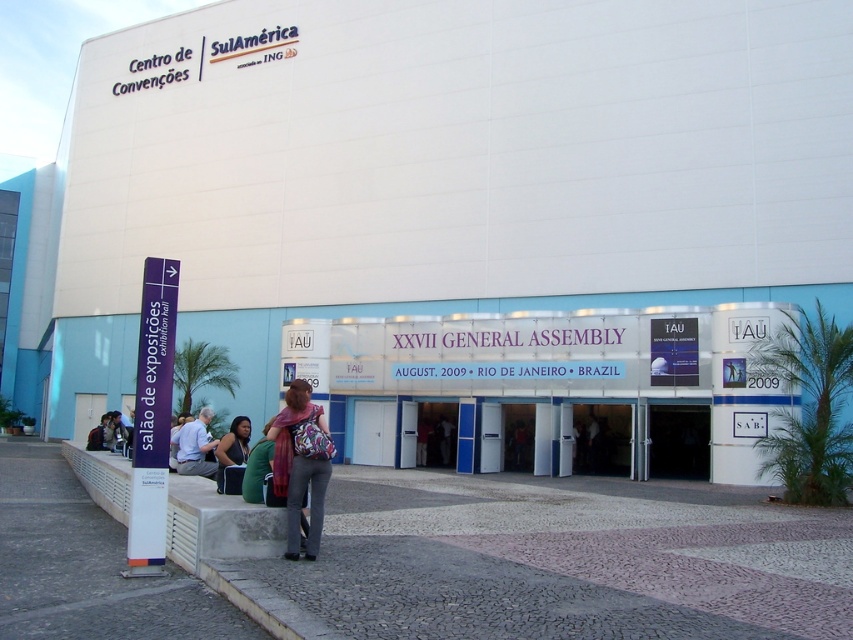
Question: Which of the following is the closest to the observer?

Choices:
 (A) (206, 444)
 (B) (486, 376)
 (C) (242, 420)
 (D) (312, 513)

Answer: (D)

Question: Which point is closer to the camera taking this photo?

Choices:
 (A) (221, 440)
 (B) (271, 436)
 (C) (183, 424)
 (D) (508, 401)

Answer: (B)

Question: Can you confirm if matte purple scarf at center is smaller than matte black jacket at lower center?

Choices:
 (A) yes
 (B) no

Answer: (A)

Question: Does light blue fabric jacket at lower left have a smaller size compared to matte black jacket at lower center?

Choices:
 (A) yes
 (B) no

Answer: (A)

Question: Which is farther from the matte black jacket at lower center?

Choices:
 (A) white glossy signboard at center
 (B) matte purple scarf at center

Answer: (A)

Question: Can you confirm if white glossy signboard at center is smaller than light blue fabric jacket at lower left?

Choices:
 (A) yes
 (B) no

Answer: (B)